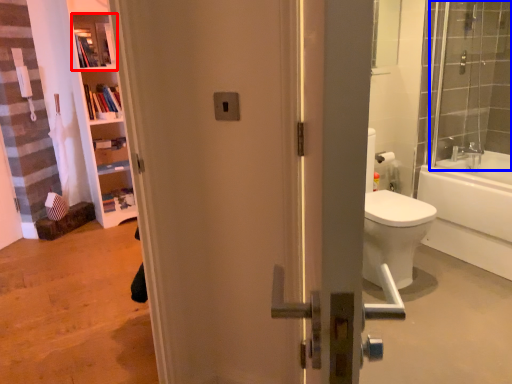
Question: Among these objects, which one is farthest to the camera, shelf (highlighted by a red box) or shower door (highlighted by a blue box)?

Choices:
 (A) shelf
 (B) shower door

Answer: (A)